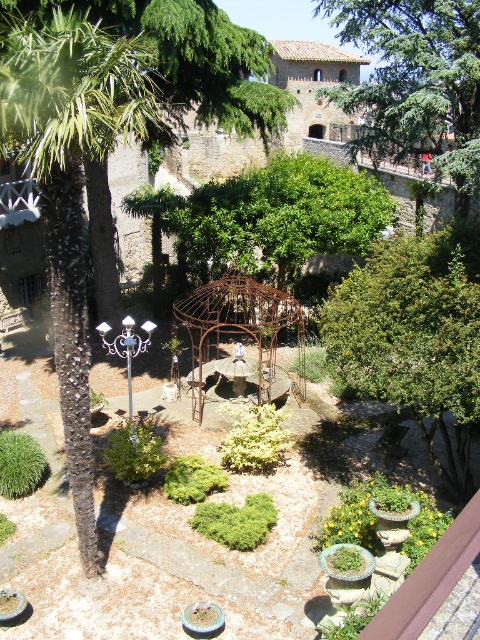
Question: Can you confirm if green leafy tree at upper center is positioned below rusty metal gazebo at center?

Choices:
 (A) no
 (B) yes

Answer: (A)

Question: Which object appears farthest from the camera in this image?

Choices:
 (A) green leafy tree at center
 (B) green leafy tree at upper center
 (C) dark brown textured palm tree at left
 (D) rusty metal gazebo at center

Answer: (D)

Question: Is dark brown textured palm tree at left further to camera compared to green leafy tree at upper center?

Choices:
 (A) yes
 (B) no

Answer: (B)

Question: Does dark brown textured palm tree at left lie in front of green leafy tree at upper center?

Choices:
 (A) yes
 (B) no

Answer: (A)

Question: Which point is closer to the camera taking this photo?

Choices:
 (A) (301, 355)
 (B) (336, 296)
 (C) (436, 81)

Answer: (B)

Question: Which point is farther from the camera taking this photo?

Choices:
 (A) (289, 316)
 (B) (75, 404)

Answer: (A)